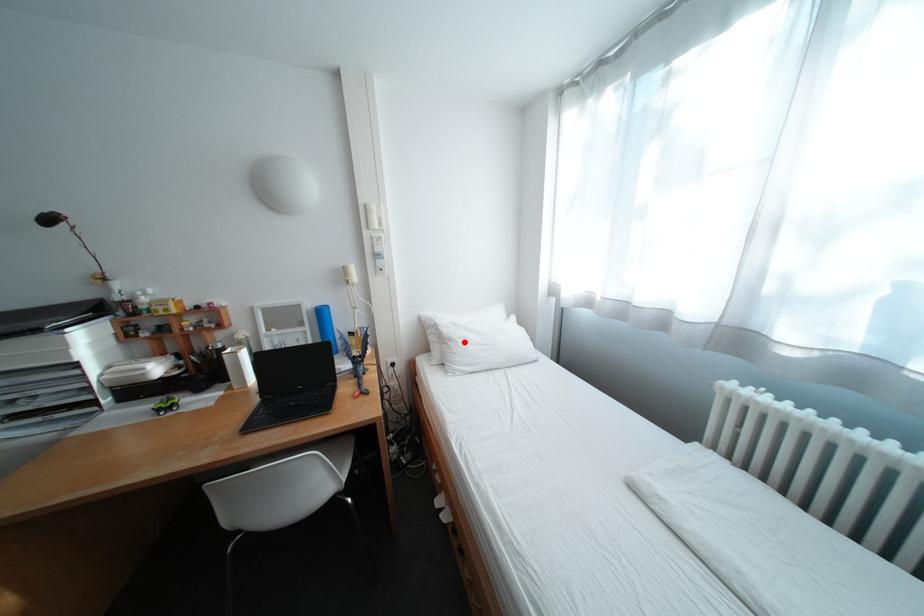
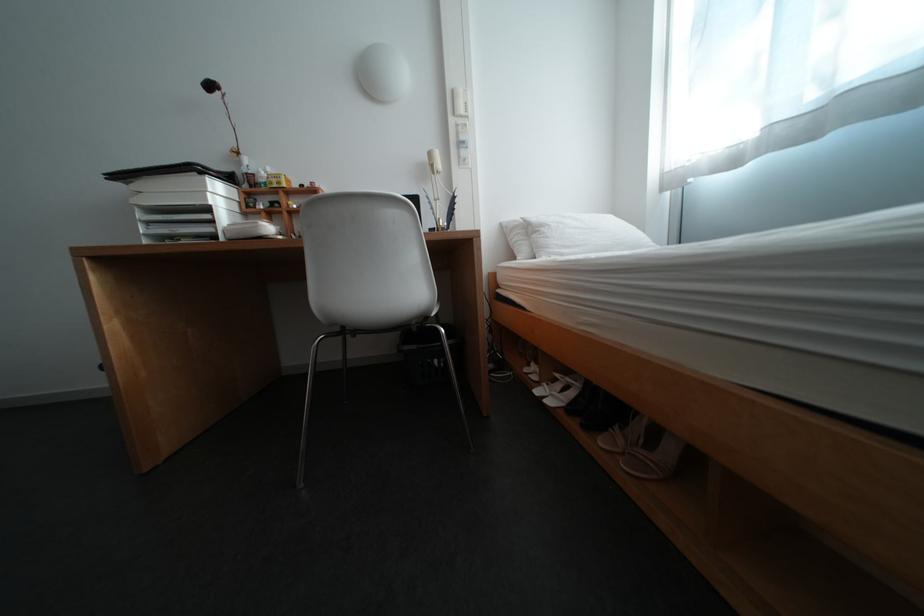
In the second image, find the point that corresponds to the highlighted location in the first image.

(555, 228)